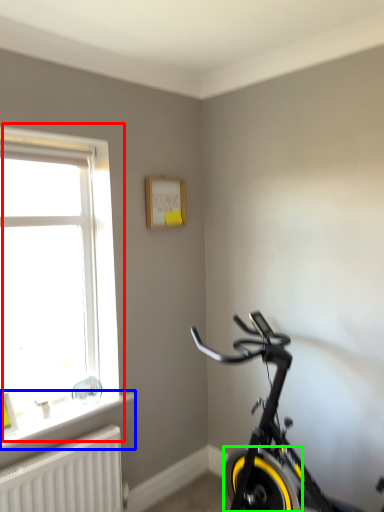
Question: Based on their relative distances, which object is farther from window (highlighted by a red box)? Choose from window sill (highlighted by a blue box) and bicycle wheel (highlighted by a green box).

Choices:
 (A) window sill
 (B) bicycle wheel

Answer: (B)